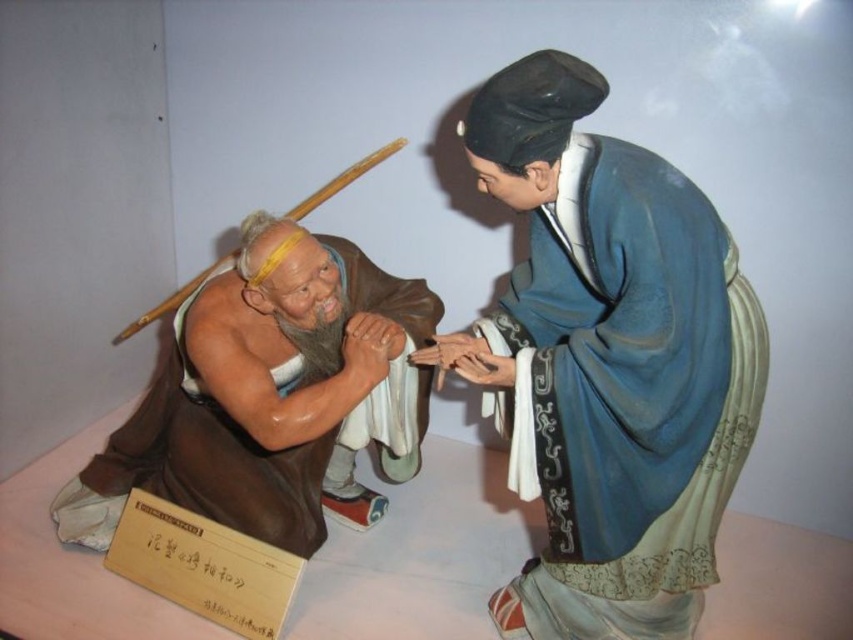
You are an art curator examining the two figurines in the scene. You need to determine the spatial relationship between the blue silk robe at upper right and the brown matte statue at left. Which object is positioned higher in the image?

The blue silk robe at upper right is located above the brown matte statue at left, so it is positioned higher in the image.

You are an art curator arranging an exhibition and need to place a label next to both the blue silk robe at upper right and the brown matte statue at left. Since the label must be placed between them, where should you position it?

The label should be placed between the blue silk robe at upper right and the brown matte statue at left, aligned to the right side of the brown matte statue at left since the blue silk robe at upper right is positioned on the right side of it.